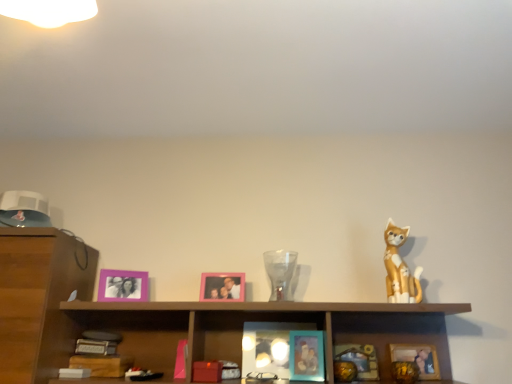
Question: Is point 132,273 closer or farther from the camera than point 286,261?

Choices:
 (A) farther
 (B) closer

Answer: (B)

Question: In terms of size, does purple matte picture frame at upper left, the fifth picture frame positioned from the right, appear bigger or smaller than transparent glass vase at center?

Choices:
 (A) small
 (B) big

Answer: (A)

Question: Which of these objects is positioned closest to the transparent glass vase at center?

Choices:
 (A) purple matte picture frame at upper left, the fifth picture frame positioned from the right
 (B) pink matte picture frame at center, acting as the 2th picture frame starting from the left
 (C) matte orange cat figurine at right
 (D) teal matte picture frame at lower center, marked as the 2th picture frame in a right-to-left arrangement
 (E) wooden cabinet at center

Answer: (B)

Question: Which is farther from the teal glossy picture frame at center, the third picture frame positioned from the right?

Choices:
 (A) teal matte picture frame at lower center, marked as the 2th picture frame in a right-to-left arrangement
 (B) matte orange cat figurine at right
 (C) purple matte picture frame at upper left, arranged as the first picture frame when viewed from the left
 (D) wooden cabinet at center
 (E) pink matte picture frame at center, which is counted as the fourth picture frame, starting from the right

Answer: (C)